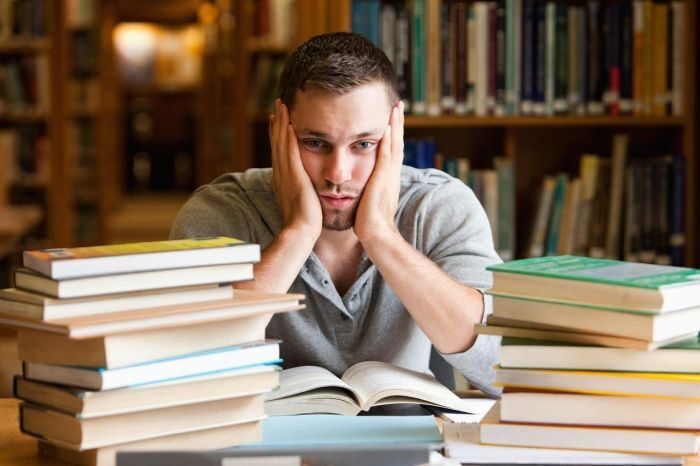
The width and height of the screenshot is (700, 466). Identify the location of books on left. (211, 262), (210, 282), (197, 288), (197, 306), (197, 343), (197, 357), (192, 387), (190, 414), (190, 447).